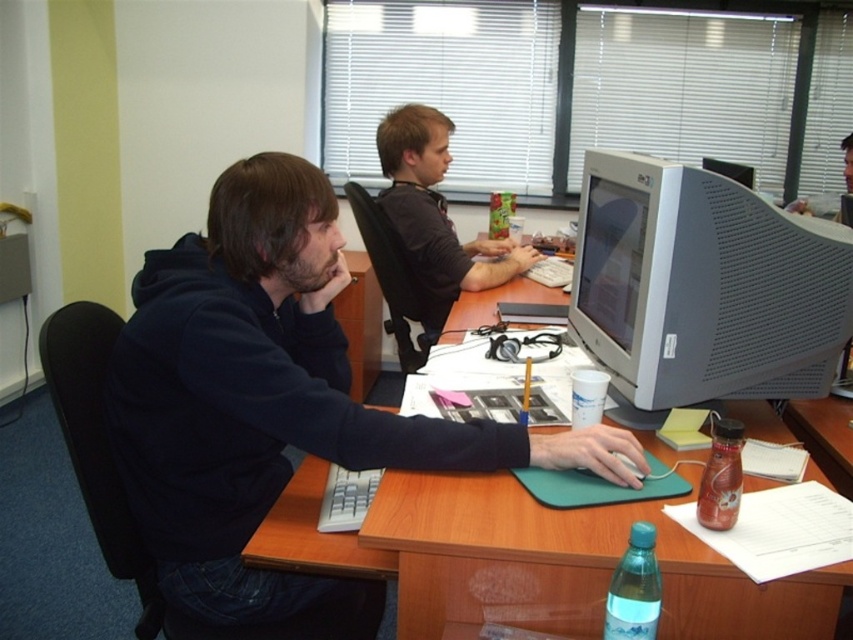
How distant is dark blue hoodie at center from green plastic mousepad at center?

The distance of dark blue hoodie at center from green plastic mousepad at center is 29.34 centimeters.

Looking at this image, which of these two, dark blue hoodie at center or green plastic mousepad at center, stands shorter?

Standing shorter between the two is green plastic mousepad at center.

Who is more distant from viewer, [503,456] or [529,541]?

Positioned behind is point [503,456].

Identify the location of dark blue hoodie at center. 270,396.

Is gray plastic monitor at right positioned before matte black shirt at center?

Yes, gray plastic monitor at right is in front of matte black shirt at center.

Who is taller, gray plastic monitor at right or matte black shirt at center?

Standing taller between the two is matte black shirt at center.

In order to click on gray plastic monitor at right in this screenshot , I will do `click(701, 289)`.

This screenshot has height=640, width=853. In order to click on gray plastic monitor at right in this screenshot , I will do `click(701, 289)`.

Consider the image. Does gray plastic monitor at right have a greater width compared to green plastic mousepad at center?

No.

Is gray plastic monitor at right above green plastic mousepad at center?

Yes, gray plastic monitor at right is above green plastic mousepad at center.

Is point (682, 317) positioned after point (503, 616)?

Yes, it is.

Find the location of `gray plastic monitor at right`. gray plastic monitor at right is located at coordinates (701, 289).